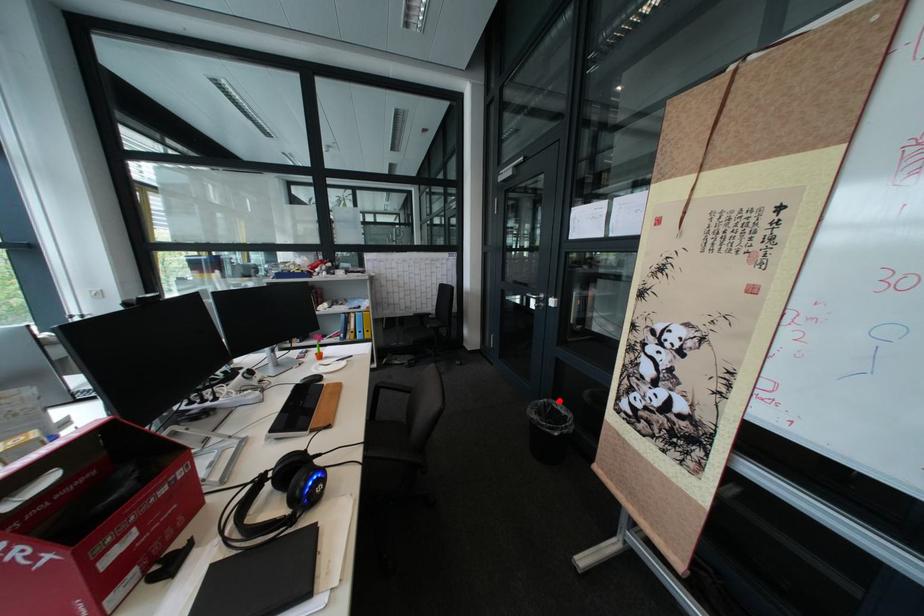
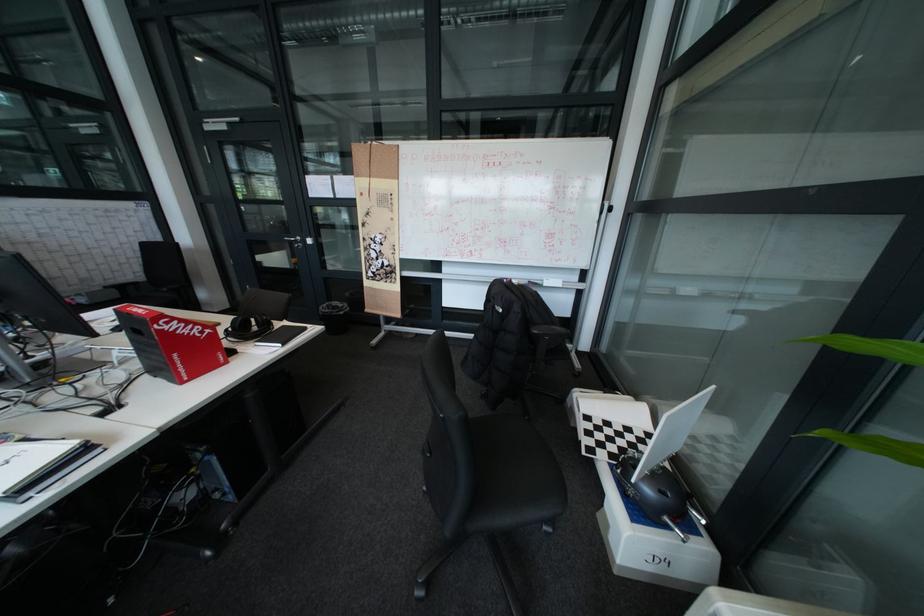
Where in the second image is the point corresponding to the highlighted location from the first image?

(341, 304)